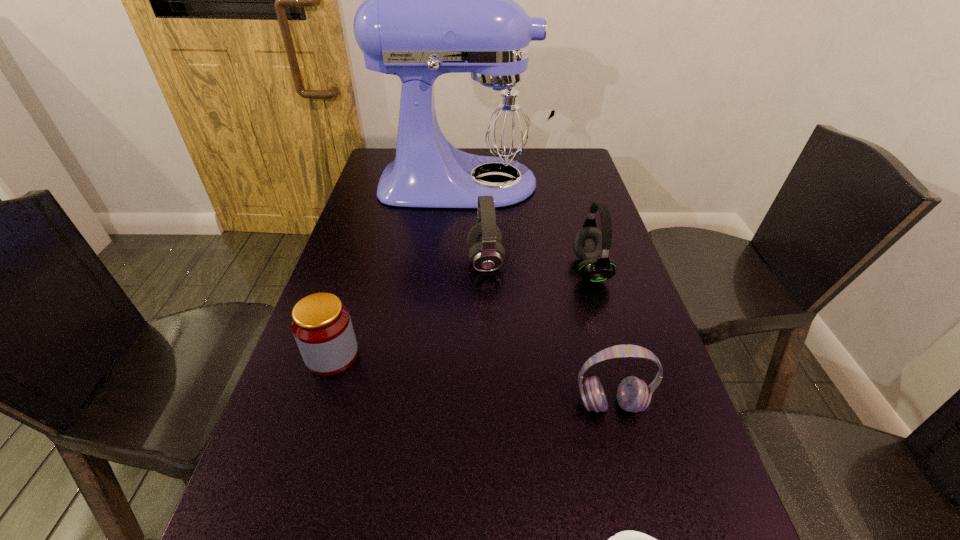
Identify the location of the tallest object. (438, 0).

I want to click on mixer, so click(x=438, y=0).

This screenshot has width=960, height=540. In order to click on the leftmost headset in this screenshot , I will do `click(484, 239)`.

The width and height of the screenshot is (960, 540). I want to click on the shortest headset, so click(633, 395).

What are the coordinates of `the nearest headset` in the screenshot? It's located at (633, 395).

Find the location of a particular element. This screenshot has height=540, width=960. the third nearest object is located at coordinates (321, 325).

Where is `vacant region located 0.120m at the mixing area of the mixer`? Image resolution: width=960 pixels, height=540 pixels. vacant region located 0.120m at the mixing area of the mixer is located at coordinates (584, 184).

You are a GUI agent. You are given a task and a screenshot of the screen. Output one action in this format:
    pyautogui.click(x=<x>, y=<y>)
    Task: Click on the vacant space located on the ear cups of the leftmost headset
    
    Given the screenshot: What is the action you would take?
    pyautogui.click(x=364, y=261)

Where is `vacant space located 0.280m on the ear cups of the leftmost headset`? vacant space located 0.280m on the ear cups of the leftmost headset is located at coordinates (364, 261).

This screenshot has height=540, width=960. I want to click on free space located on the ear cups of the leftmost headset, so click(x=342, y=261).